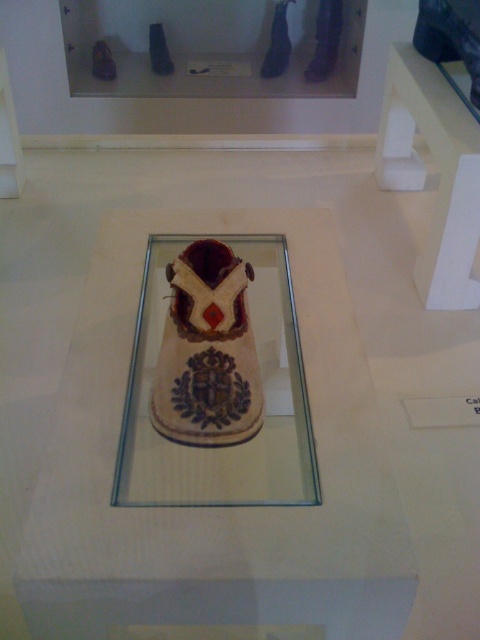
You are a museum visitor holding a small souvenir that you want to place on either the transparent glass at center or the white matte table at upper right. Which surface has more space available to place your souvenir?

The white matte table at upper right has more space available because the transparent glass at center occupies less space than it.

You are standing in front of the museum display and want to take a closer look at the shoe. The camera is positioned where you are standing. If you move forward 0.5 meters, will the point marked as point [287,381] on the shoe be within your reach?

The point marked as point [287,381] is 1.06 meters away from the camera. If you move forward 0.5 meters, the distance becomes 0.56 meters. Since the shoe is enclosed in a glass display box, you cannot reach it regardless of the distance.

You are a security guard in the museum and need to inspect the transparent glass at center and the white matte table at upper right. Which object is positioned lower in the scene?

The transparent glass at center is located below the white matte table at upper right, so it is positioned lower in the scene.